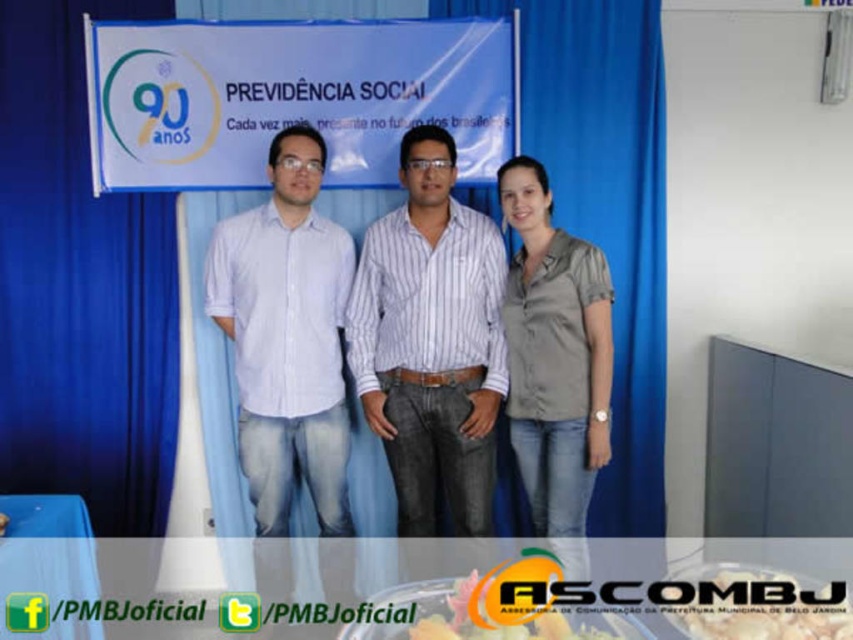
You are at the event and want to place a snack on the white paper plate at center. To do so, from where you are standing, should you move toward the left or right of the blue plastic table at lower left?

The blue plastic table at lower left is to the left of the white paper plate at center. To place the snack on the white paper plate at center, you should move to the right of the blue plastic table at lower left.

In the image, there is a blue fabric curtain at upper center and a white paper plate at center. Which object is positioned to the left?

The blue fabric curtain at upper center is positioned to the left of the white paper plate at center.

You are a photographer at the event and need to adjust the lighting. The blue plastic table at lower left and the yellow matte cake at center are in your view. Which object is closer to the camera?

The blue plastic table at lower left is closer to the camera because it is in front of the yellow matte cake at center.